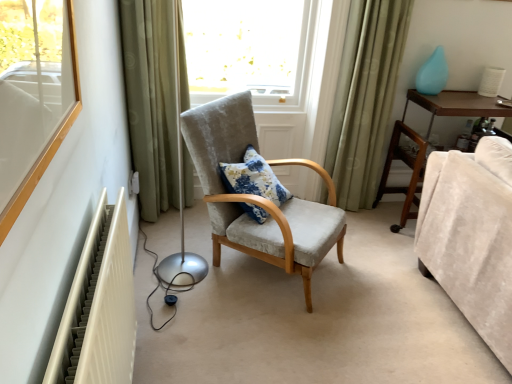
Question: Considering the positions of brown wooden dresser at right and green fabric curtain at left, the second curtain positioned from the right, in the image, is brown wooden dresser at right taller or shorter than green fabric curtain at left, the second curtain positioned from the right,?

Choices:
 (A) short
 (B) tall

Answer: (A)

Question: Is point (400, 148) closer or farther from the camera than point (144, 104)?

Choices:
 (A) farther
 (B) closer

Answer: (A)

Question: Which of these objects is positioned farthest from the velvet beige couch at lower right?

Choices:
 (A) teal glossy vase at upper right
 (B) green fabric curtain at left, the second curtain positioned from the right
 (C) white plastic electric outlet at lower left
 (D) green fabric curtain at right, placed as the second curtain when sorted from left to right
 (E) brown wooden dresser at right

Answer: (C)

Question: Estimate the real-world distances between objects in this image. Which object is closer to the green fabric curtain at right, the first curtain viewed from the right?

Choices:
 (A) floral fabric pillow at center
 (B) velvet beige couch at lower right
 (C) white plastic electric outlet at lower left
 (D) teal glossy vase at upper right
 (E) brown wooden dresser at right

Answer: (E)